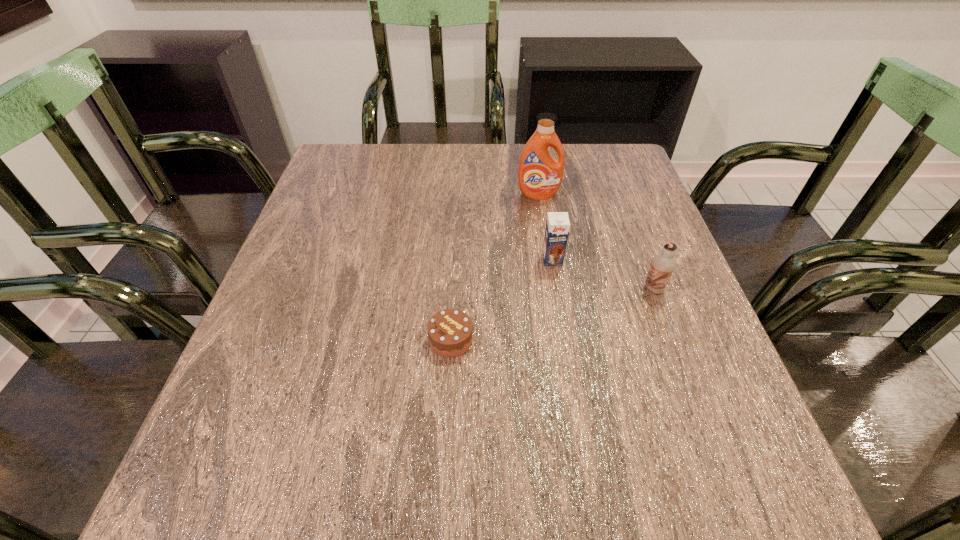
Locate an element on the screen. free space between the leftmost object and the second nearest object is located at coordinates (552, 314).

Image resolution: width=960 pixels, height=540 pixels. In order to click on unoccupied position between the rightmost object and the shortest object in this screenshot , I will do `click(552, 314)`.

Identify which object is the closest to the left chocolate milk. Please provide its 2D coordinates. Your answer should be formatted as a tuple, i.e. [(x, y)], where the tuple contains the x and y coordinates of a point satisfying the conditions above.

[(662, 266)]

Where is `the third closest object to the left chocolate milk`? The width and height of the screenshot is (960, 540). the third closest object to the left chocolate milk is located at coordinates (450, 332).

This screenshot has height=540, width=960. What are the coordinates of `free space that satisfies the following two spatial constraints: 1. on the front-facing side of the farthest object; 2. on the right side of the nearer chocolate milk` in the screenshot? It's located at (553, 288).

Identify the location of free space that satisfies the following two spatial constraints: 1. on the front-facing side of the right chocolate milk; 2. on the right side of the detergent. The height and width of the screenshot is (540, 960). (553, 288).